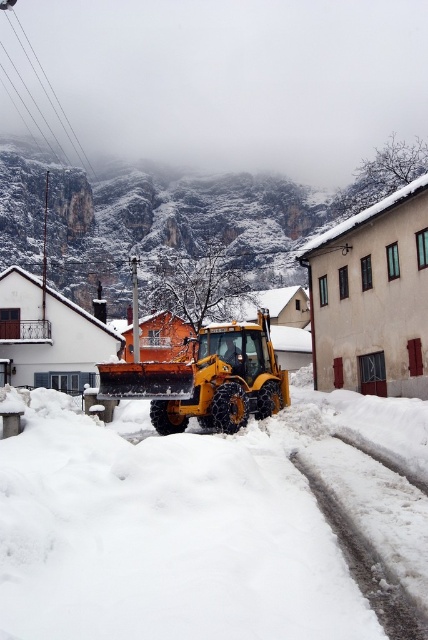
Does white fluffy snow at center appear on the left side of yellow rubber plow at center?

Incorrect, white fluffy snow at center is not on the left side of yellow rubber plow at center.

Who is positioned more to the right, white fluffy snow at center or yellow rubber plow at center?

From the viewer's perspective, white fluffy snow at center appears more on the right side.

Who is more forward, (151,445) or (249,342)?

Point (151,445)

Where is `white fluffy snow at center`? white fluffy snow at center is located at coordinates (205, 522).